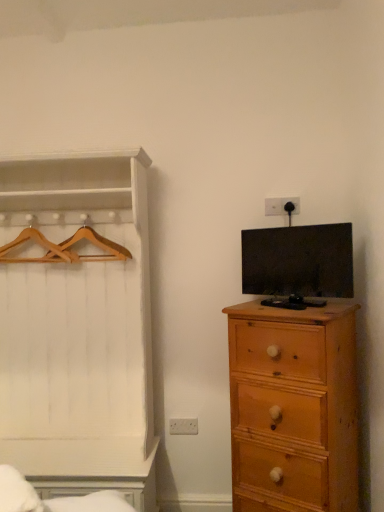
Question: Should I look upward or downward to see matte black tv at right?

Choices:
 (A) down
 (B) up

Answer: (A)

Question: Can you confirm if wooden hanger at left, which is counted as the 2th hanger, starting from the right, is wider than light brown wooden chest of drawers at right?

Choices:
 (A) yes
 (B) no

Answer: (B)

Question: Is light brown wooden chest of drawers at right completely or partially inside wooden hanger at left, which is counted as the 2th hanger, starting from the right?

Choices:
 (A) no
 (B) yes

Answer: (A)

Question: Does wooden hanger at left, which appears as the first hanger when viewed from the left, have a smaller size compared to light brown wooden chest of drawers at right?

Choices:
 (A) yes
 (B) no

Answer: (A)

Question: Is wooden hanger at left, which is counted as the 2th hanger, starting from the right, not within light brown wooden chest of drawers at right?

Choices:
 (A) yes
 (B) no

Answer: (A)

Question: From the image's perspective, is wooden hanger at left, which appears as the first hanger when viewed from the left, under light brown wooden chest of drawers at right?

Choices:
 (A) no
 (B) yes

Answer: (A)

Question: Does wooden hangers at left, which appears as the 1th hanger when viewed from the right, touch light brown wooden chest of drawers at right?

Choices:
 (A) no
 (B) yes

Answer: (A)

Question: Does wooden hangers at left, placed as the 2th hanger when sorted from left to right, have a lesser height compared to light brown wooden chest of drawers at right?

Choices:
 (A) yes
 (B) no

Answer: (A)

Question: From a real-world perspective, is wooden hangers at left, placed as the 2th hanger when sorted from left to right, under light brown wooden chest of drawers at right?

Choices:
 (A) yes
 (B) no

Answer: (B)

Question: Is the depth of wooden hangers at left, which appears as the 1th hanger when viewed from the right, greater than that of light brown wooden chest of drawers at right?

Choices:
 (A) no
 (B) yes

Answer: (B)

Question: Is the depth of wooden hangers at left, which appears as the 1th hanger when viewed from the right, less than that of light brown wooden chest of drawers at right?

Choices:
 (A) no
 (B) yes

Answer: (A)

Question: Is wooden hangers at left, placed as the 2th hanger when sorted from left to right, turned away from light brown wooden chest of drawers at right?

Choices:
 (A) no
 (B) yes

Answer: (A)

Question: Is wooden hanger at left, which is counted as the 2th hanger, starting from the right, at the right side of wooden hangers at left, placed as the 2th hanger when sorted from left to right?

Choices:
 (A) yes
 (B) no

Answer: (B)